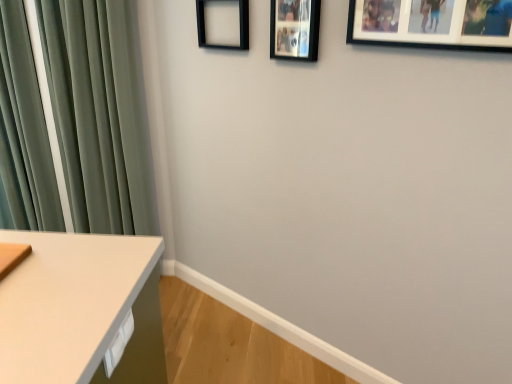
Question: From a real-world perspective, is black matte picture frame at upper right, the 1th picture frame in the front-to-back sequence, positioned under black matte picture frame at upper center, marked as the second picture frame in a right-to-left arrangement, based on gravity?

Choices:
 (A) yes
 (B) no

Answer: (B)

Question: Is the surface of black matte picture frame at upper right, the 1th picture frame in the front-to-back sequence, in direct contact with black matte picture frame at upper center, acting as the 2th picture frame starting from the front?

Choices:
 (A) yes
 (B) no

Answer: (B)

Question: Can you confirm if black matte picture frame at upper right, which is the first picture frame from right to left, is positioned to the left of black matte picture frame at upper center, acting as the 2th picture frame starting from the front?

Choices:
 (A) no
 (B) yes

Answer: (A)

Question: From the image's perspective, is black matte picture frame at upper right, the 1th picture frame in the front-to-back sequence, over black matte picture frame at upper center, placed as the 2th picture frame when sorted from back to front?

Choices:
 (A) yes
 (B) no

Answer: (B)

Question: Does black matte picture frame at upper right, which is the first picture frame from right to left, have a lesser width compared to black matte picture frame at upper center, marked as the second picture frame in a right-to-left arrangement?

Choices:
 (A) no
 (B) yes

Answer: (A)

Question: From a real-world perspective, is black matte picture frame at upper right, the 1th picture frame in the front-to-back sequence, physically above black matte picture frame at upper center, placed as the 2th picture frame when sorted from back to front?

Choices:
 (A) no
 (B) yes

Answer: (B)

Question: Considering the relative positions of green velvet curtain at left and black matte picture frame at upper center, which is the 3th picture frame in right-to-left order, in the image provided, is green velvet curtain at left to the right of black matte picture frame at upper center, which is the 3th picture frame in right-to-left order, from the viewer's perspective?

Choices:
 (A) no
 (B) yes

Answer: (A)

Question: Is green velvet curtain at left located outside black matte picture frame at upper center, the 1th picture frame positioned from the back?

Choices:
 (A) yes
 (B) no

Answer: (A)

Question: Is black matte picture frame at upper center, positioned as the 3th picture frame in front-to-back order, at the back of green velvet curtain at left?

Choices:
 (A) no
 (B) yes

Answer: (A)

Question: Is the surface of green velvet curtain at left in direct contact with black matte picture frame at upper center, which appears as the first picture frame when viewed from the left?

Choices:
 (A) no
 (B) yes

Answer: (A)

Question: Is green velvet curtain at left aimed at black matte picture frame at upper center, which appears as the first picture frame when viewed from the left?

Choices:
 (A) yes
 (B) no

Answer: (B)

Question: From the image's perspective, does green velvet curtain at left appear lower than black matte picture frame at upper center, the 1th picture frame positioned from the back?

Choices:
 (A) no
 (B) yes

Answer: (B)

Question: From a real-world perspective, is black matte picture frame at upper center, which is the second picture frame in left-to-right order, positioned under green velvet curtain at left based on gravity?

Choices:
 (A) yes
 (B) no

Answer: (B)